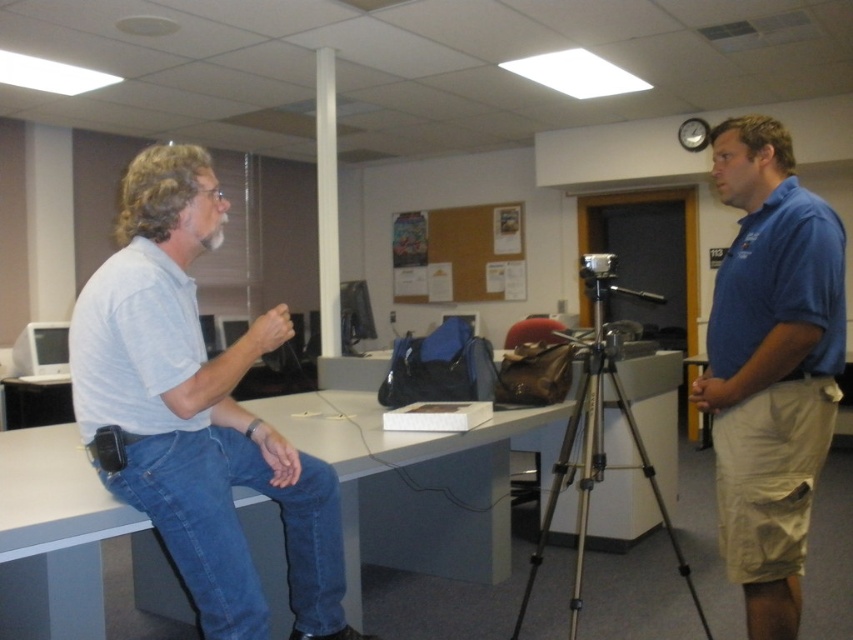
Question: Which point is closer to the camera?

Choices:
 (A) silver metallic tripod at center
 (B) white glossy table at center

Answer: (B)

Question: Is white glossy table at center below blue cotton shirt at right?

Choices:
 (A) no
 (B) yes

Answer: (B)

Question: Which is farther from the blue cotton shirt at right?

Choices:
 (A) silver metallic tripod at center
 (B) white glossy table at center
 (C) denim at left
 (D) light gray cotton shirt at left

Answer: (D)

Question: Which point is closer to the camera?

Choices:
 (A) white glossy table at center
 (B) silver metallic tripod at center
 (C) blue cotton shirt at right
 (D) denim at left

Answer: (D)

Question: Is white glossy table at center below denim at left?

Choices:
 (A) no
 (B) yes

Answer: (A)

Question: Is white glossy table at center closer to the viewer compared to denim at left?

Choices:
 (A) yes
 (B) no

Answer: (B)